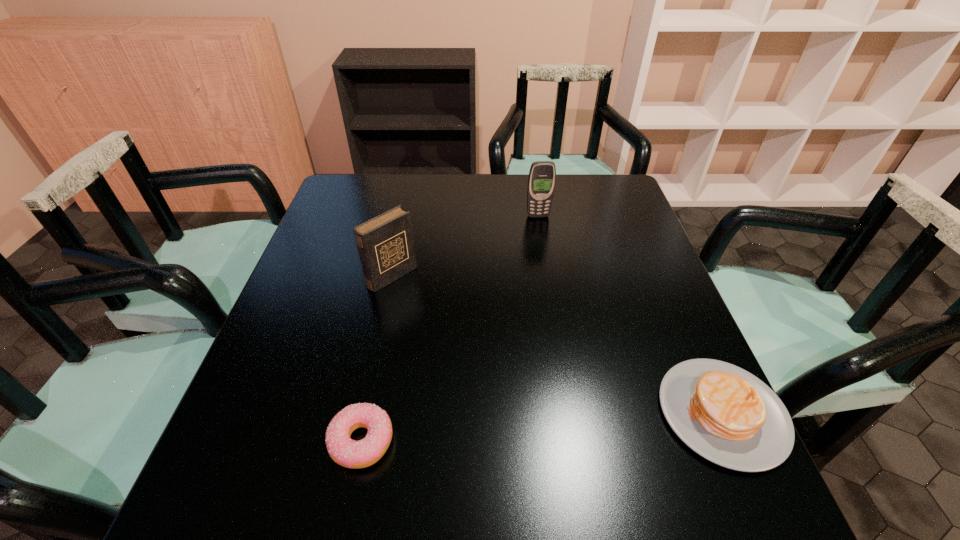
Image resolution: width=960 pixels, height=540 pixels. In order to click on free space on the desktop that is between the shortest object and the rightmost object and is positioned on the front cover of the second farthest object in this screenshot , I will do `click(574, 424)`.

Where is `vacant space on the desktop that is between the shortest object and the pancake and is positioned on the screen of the cellular telephone`? This screenshot has width=960, height=540. vacant space on the desktop that is between the shortest object and the pancake and is positioned on the screen of the cellular telephone is located at coordinates (589, 423).